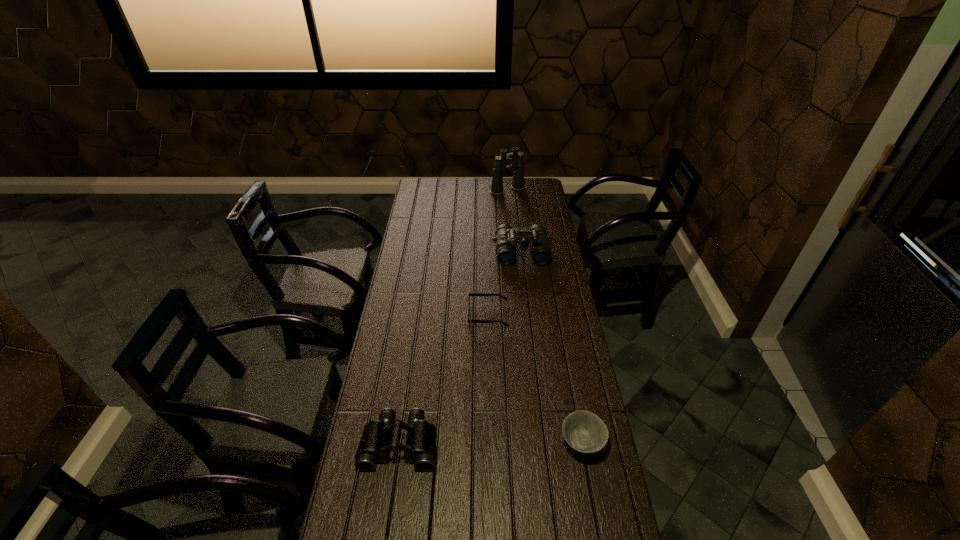
Find the location of a particular element. The height and width of the screenshot is (540, 960). free space located 0.140m through the lenses of the second farthest object is located at coordinates (525, 286).

Locate an element on the screen. free spot located 0.130m on the front-facing side of the nearest binoculars is located at coordinates (389, 518).

Locate an element on the screen. This screenshot has height=540, width=960. vacant space located on the left of the fourth tallest object is located at coordinates (512, 443).

Locate an element on the screen. vacant space located on the arms of the third farthest object is located at coordinates (391, 315).

In order to click on vacant space located on the arms of the third farthest object in this screenshot , I will do `click(440, 315)`.

Where is `vacant space located on the arms of the third farthest object`? vacant space located on the arms of the third farthest object is located at coordinates (440, 315).

Locate an element on the screen. object at the far edge is located at coordinates (516, 158).

Image resolution: width=960 pixels, height=540 pixels. I want to click on object that is positioned at the left edge, so click(x=374, y=446).

Locate an element on the screen. This screenshot has height=540, width=960. bowl that is at the right edge is located at coordinates (584, 431).

At what (x,y) coordinates should I click in order to perform the action: click on object positioned at the far right corner. Please return your answer as a coordinate pair (x, y). The width and height of the screenshot is (960, 540). Looking at the image, I should click on (516, 158).